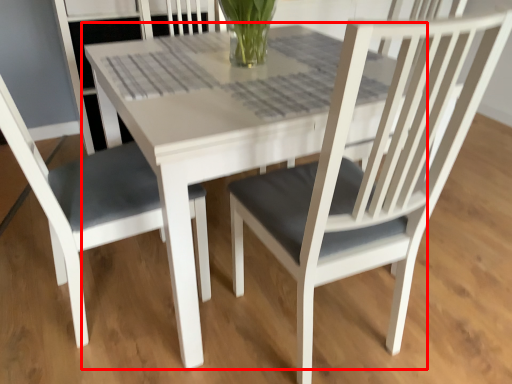
Question: From the image's perspective, what is the correct spatial relationship of round table (annotated by the red box) in relation to chair?

Choices:
 (A) below
 (B) above

Answer: (B)